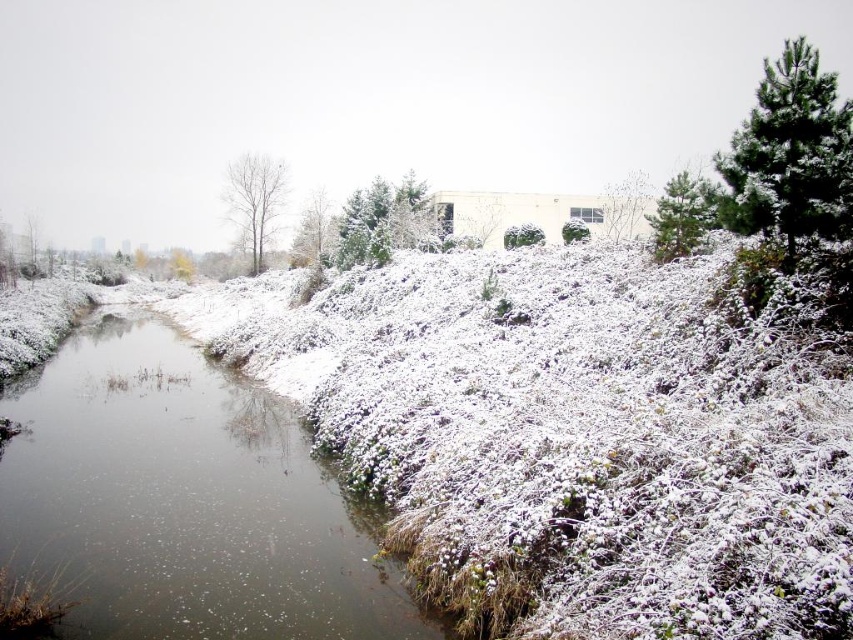
Question: Which of the following is the closest to the observer?

Choices:
 (A) white matte tree at center
 (B) clear water at center

Answer: (B)

Question: Estimate the real-world distances between objects in this image. Which object is farther from the green matte tree at center?

Choices:
 (A) snow-covered pine tree at upper right
 (B) bare wood tree at center
 (C) clear water at center

Answer: (B)

Question: Does bare wood tree at center appear on the left side of green matte tree at upper center?

Choices:
 (A) no
 (B) yes

Answer: (B)

Question: Does green matte tree at upper center appear on the right side of white matte tree at center?

Choices:
 (A) yes
 (B) no

Answer: (A)

Question: Which object is the closest to the bare wood tree at center?

Choices:
 (A) green matte tree at upper center
 (B) snow-covered pine tree at upper right

Answer: (A)

Question: Is clear water at center behind snow-covered pine tree at upper right?

Choices:
 (A) no
 (B) yes

Answer: (A)